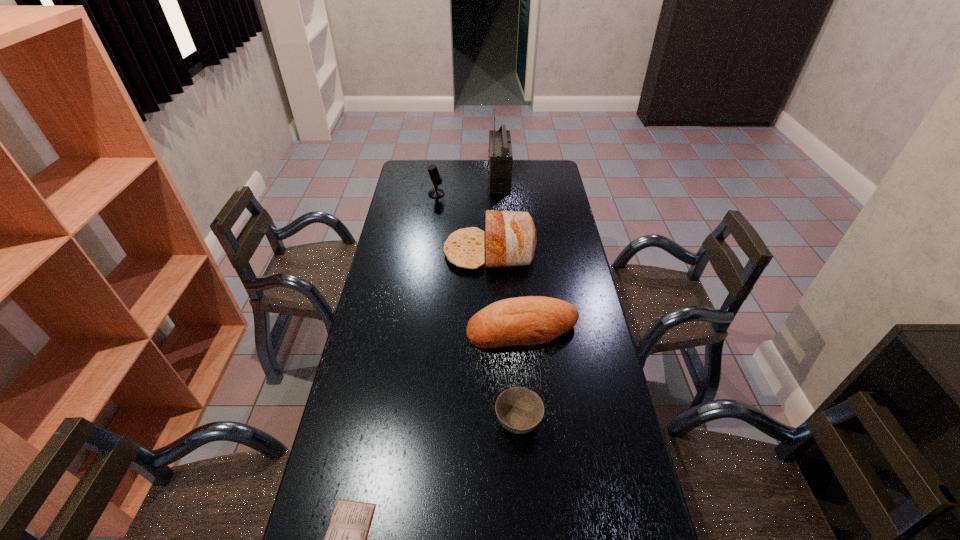
Locate an element on the screen. The width and height of the screenshot is (960, 540). free space that satisfies the following two spatial constraints: 1. at the sliced end of the farther bread; 2. on the right side of the fourth farthest object is located at coordinates (491, 328).

Where is `vacant area in the image that satisfies the following two spatial constraints: 1. at the sliced end of the taller bread; 2. on the right side of the nearer bread`? This screenshot has height=540, width=960. vacant area in the image that satisfies the following two spatial constraints: 1. at the sliced end of the taller bread; 2. on the right side of the nearer bread is located at coordinates (491, 328).

Locate an element on the screen. The height and width of the screenshot is (540, 960). free space that satisfies the following two spatial constraints: 1. on the back side of the shorter bread; 2. at the sliced end of the taller bread is located at coordinates pyautogui.click(x=516, y=252).

Identify the location of vacant area in the image that satisfies the following two spatial constraints: 1. at the sliced end of the taller bread; 2. on the back side of the bowl. (492, 422).

This screenshot has height=540, width=960. I want to click on vacant space that satisfies the following two spatial constraints: 1. on the stand of the fifth object from right to left; 2. on the left side of the fifth tallest object, so click(406, 422).

In order to click on vacant space that satisfies the following two spatial constraints: 1. on the front panel of the bowl; 2. on the right side of the tallest object in this screenshot , I will do `click(514, 422)`.

At what (x,y) coordinates should I click in order to perform the action: click on free space that satisfies the following two spatial constraints: 1. on the front panel of the tallest object; 2. on the right side of the fifth tallest object. Please return your answer as a coordinate pair (x, y). The height and width of the screenshot is (540, 960). Looking at the image, I should click on (514, 422).